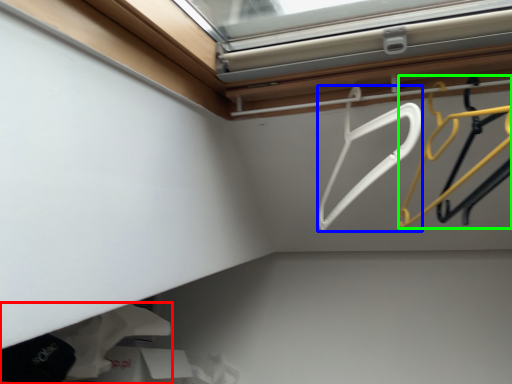
Question: Estimate the real-world distances between objects in this image. Which object is farther from clothing (highlighted by a red box), hanger (highlighted by a blue box) or hanger (highlighted by a green box)?

Choices:
 (A) hanger
 (B) hanger

Answer: (B)